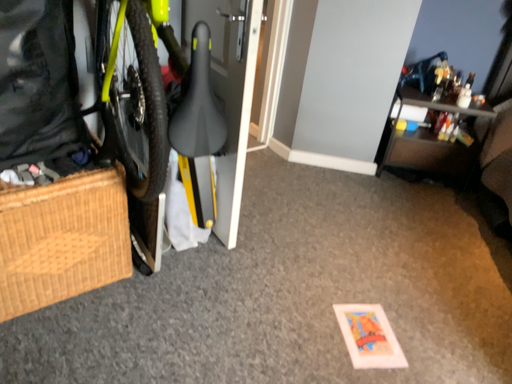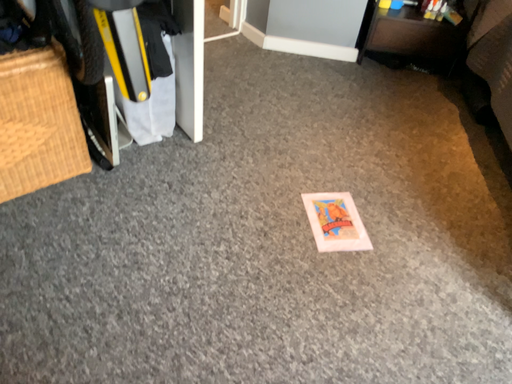
Question: How did the camera likely rotate when shooting the video?

Choices:
 (A) rotated downward
 (B) rotated upward

Answer: (A)